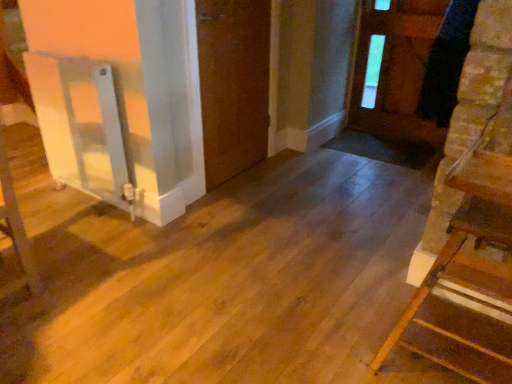
Question: Is point (414, 6) positioned closer to the camera than point (506, 354)?

Choices:
 (A) closer
 (B) farther

Answer: (B)

Question: Considering their positions, is brown wooden door at upper right, which appears as the first door when viewed from the right, located in front of or behind wooden staircase at right?

Choices:
 (A) front
 (B) behind

Answer: (B)

Question: Which of these objects is positioned closest to the wooden staircase at right?

Choices:
 (A) brown matte door at center, acting as the 2th door starting from the right
 (B) brown wooden door at upper right, which appears as the first door when viewed from the right

Answer: (A)

Question: Which is farther from the wooden staircase at right?

Choices:
 (A) brown matte door at center, which is the 1th door from left to right
 (B) brown wooden door at upper right, marked as the 2th door in a left-to-right arrangement

Answer: (B)